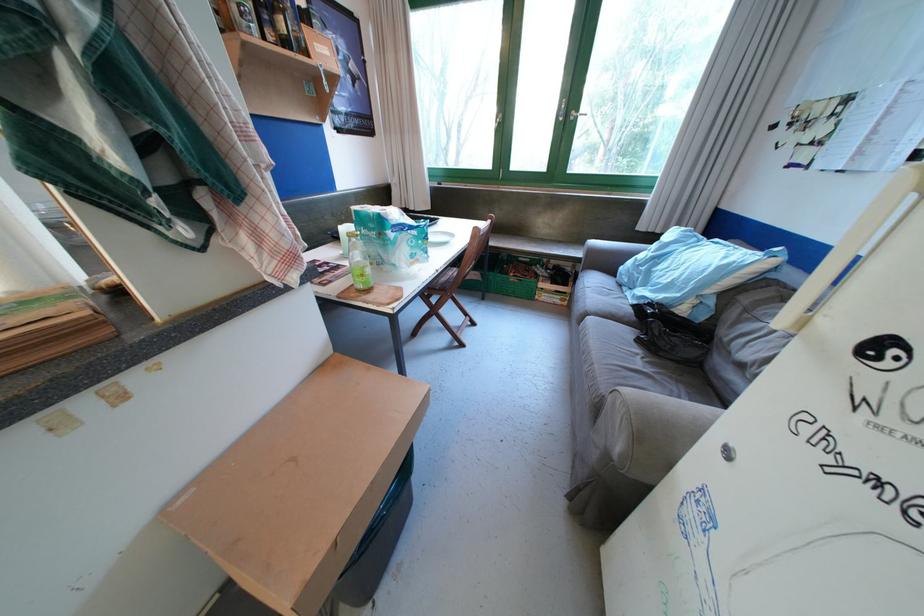
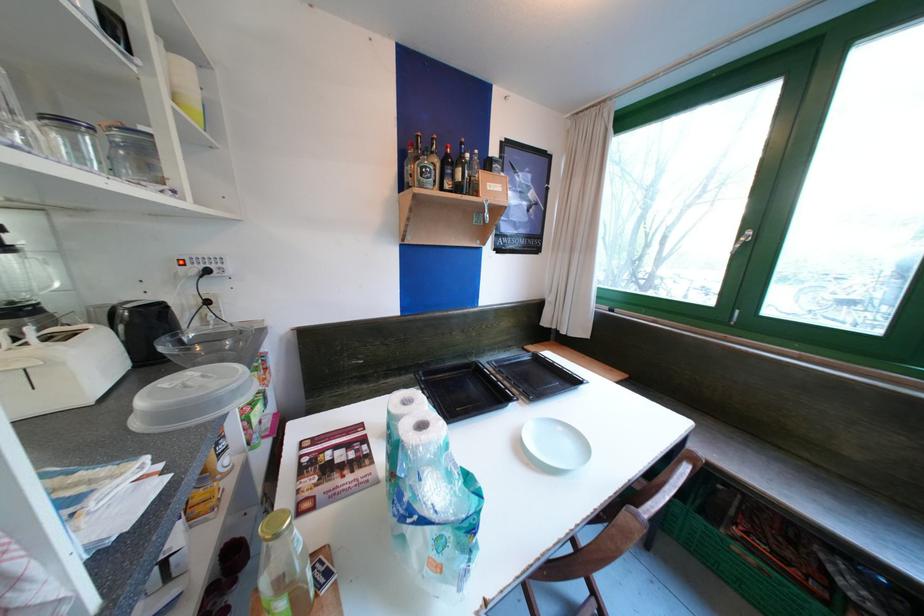
Where in the second image is the point corresponding to point 541,246 from the first image?

(835, 503)